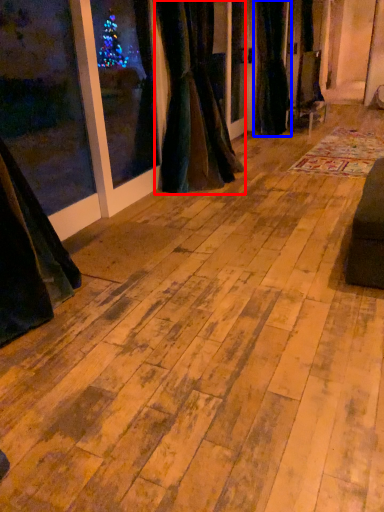
Question: Which point is closer to the camera, curtain (highlighted by a red box) or curtain (highlighted by a blue box)?

Choices:
 (A) curtain
 (B) curtain

Answer: (A)